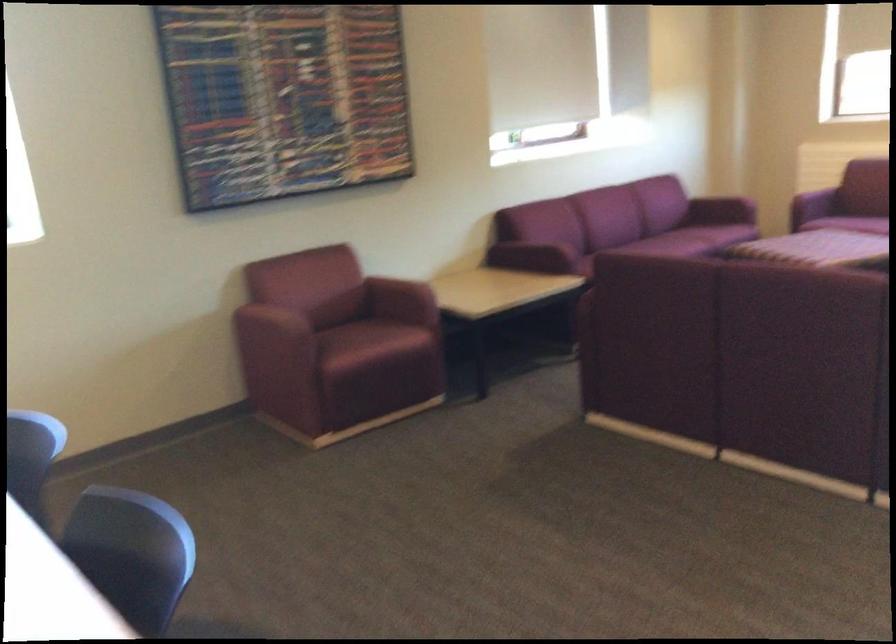
At what (x,y) coordinates should I click in order to perform the action: click on maroon chair sitting surface. Please return your answer as a coordinate pair (x, y). The height and width of the screenshot is (644, 896). Looking at the image, I should click on (373, 345).